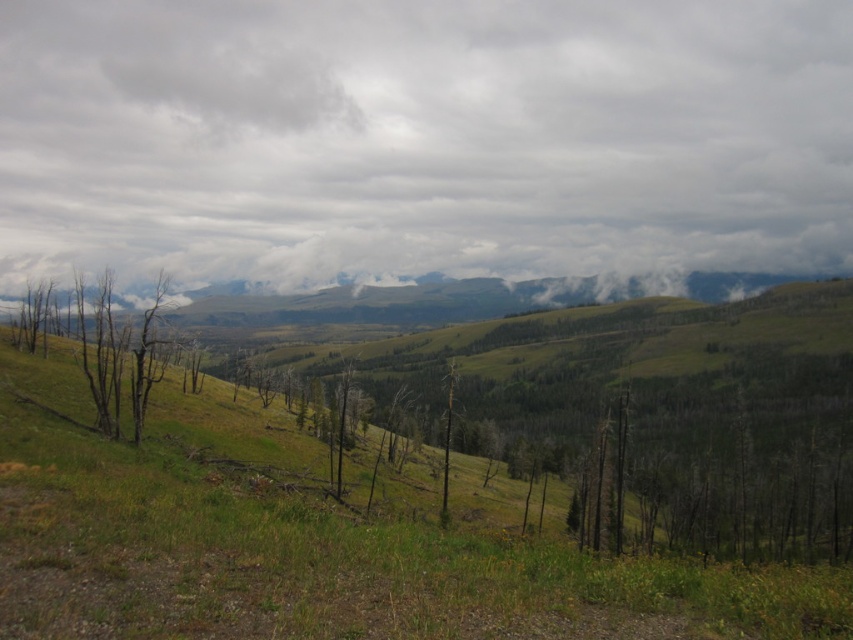
Question: Does cloudy sky at upper center appear over brown dead wood at left?

Choices:
 (A) no
 (B) yes

Answer: (B)

Question: Considering the real-world distances, which object is farthest from the green grassy at center?

Choices:
 (A) brown dead wood at left
 (B) cloudy sky at upper center

Answer: (B)

Question: Which point is farther to the camera?

Choices:
 (A) brown dead wood at left
 (B) cloudy sky at upper center
 (C) green grassy at center

Answer: (B)

Question: Does cloudy sky at upper center have a lesser width compared to brown dead wood at left?

Choices:
 (A) yes
 (B) no

Answer: (B)

Question: Based on their relative distances, which object is farther from the cloudy sky at upper center?

Choices:
 (A) brown dead wood at left
 (B) green grassy at center

Answer: (A)

Question: Does cloudy sky at upper center have a lesser width compared to brown dead wood at left?

Choices:
 (A) no
 (B) yes

Answer: (A)